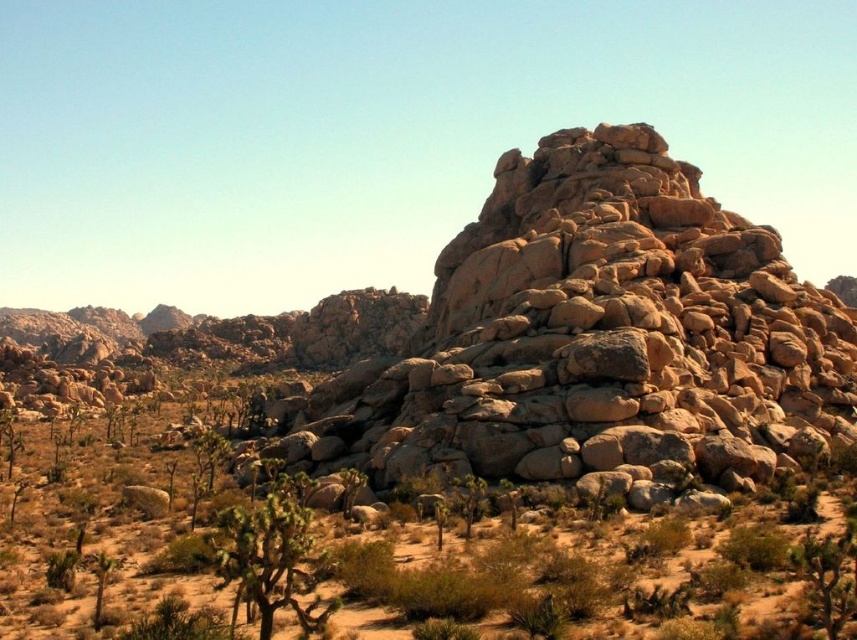
Question: Which of the following is the closest to the observer?

Choices:
 (A) (639, 612)
 (B) (616, 330)
 (C) (283, 484)

Answer: (A)

Question: Does rustic stone boulder at center lie behind green leafy bush at lower center?

Choices:
 (A) no
 (B) yes

Answer: (B)

Question: Which object is the farthest from the green leafy bush at center?

Choices:
 (A) green leafy bush at lower center
 (B) rustic stone boulder at center

Answer: (B)

Question: Can you confirm if rustic stone boulder at center is smaller than green leafy bush at lower center?

Choices:
 (A) no
 (B) yes

Answer: (A)

Question: Among these objects, which one is farthest from the camera?

Choices:
 (A) green leafy bush at lower center
 (B) green leafy bush at center

Answer: (A)

Question: Does green leafy bush at center appear over green leafy bush at lower center?

Choices:
 (A) yes
 (B) no

Answer: (A)